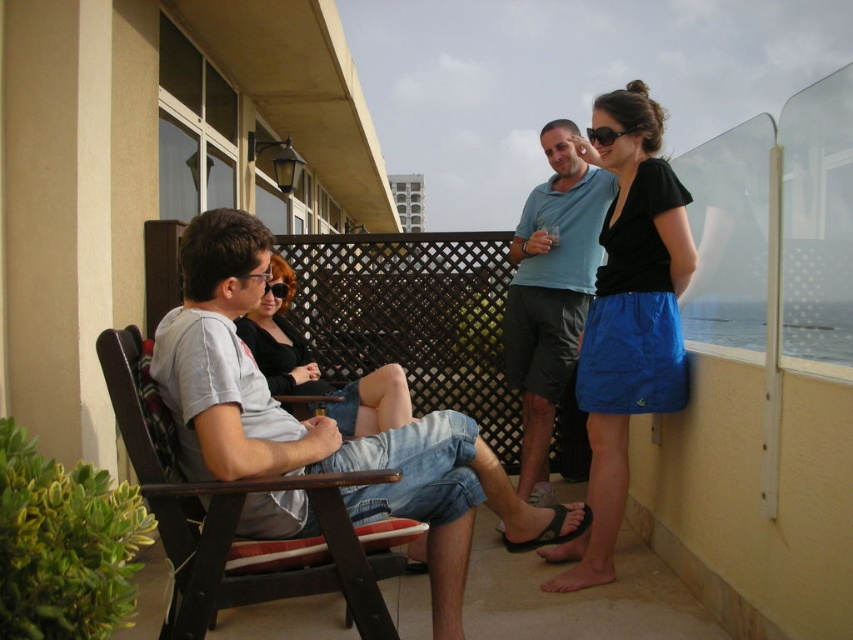
Question: Which object is closer to the camera taking this photo?

Choices:
 (A) wooden chair at center
 (B) blue cotton shirt at upper right
 (C) matte gray shirt at center

Answer: (A)

Question: Is matte gray shirt at center further to the viewer compared to matte black sunglasses at center?

Choices:
 (A) yes
 (B) no

Answer: (B)

Question: Considering the relative positions of wooden chair at center and blue cotton shirt at upper right in the image provided, where is wooden chair at center located with respect to blue cotton shirt at upper right?

Choices:
 (A) right
 (B) left

Answer: (B)

Question: Can you confirm if wooden chair at center is positioned below blue cotton shirt at upper right?

Choices:
 (A) yes
 (B) no

Answer: (A)

Question: Which point is farther to the camera?

Choices:
 (A) (662, 410)
 (B) (321, 524)

Answer: (A)

Question: Among these points, which one is nearest to the camera?

Choices:
 (A) (171, 312)
 (B) (293, 330)

Answer: (A)